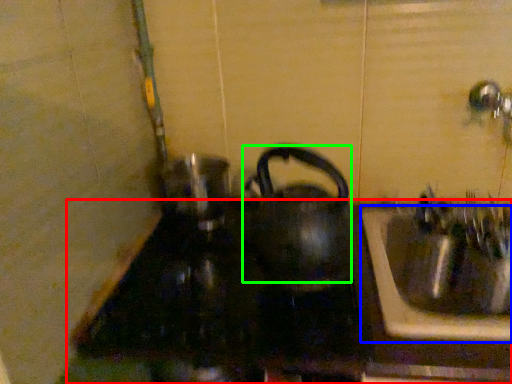
Question: Which object is the closest to the counter top (highlighted by a red box)? Choose among these: sink (highlighted by a blue box) or kettle (highlighted by a green box).

Choices:
 (A) sink
 (B) kettle

Answer: (A)